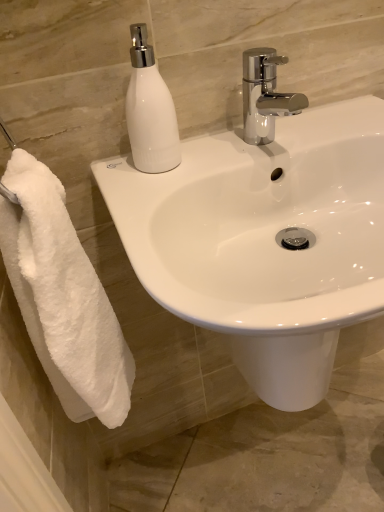
Question: Visually, is white glossy sink at center positioned to the left or to the right of chrome metallic faucet at upper center?

Choices:
 (A) left
 (B) right

Answer: (B)

Question: Considering the positions of white glossy sink at center and chrome metallic faucet at upper center in the image, is white glossy sink at center taller or shorter than chrome metallic faucet at upper center?

Choices:
 (A) short
 (B) tall

Answer: (B)

Question: Estimate the real-world distances between objects in this image. Which object is farther from the white glossy sink at center?

Choices:
 (A) white fluffy towel at left
 (B) chrome metallic faucet at upper center
 (C) white glossy soap dispenser at upper left

Answer: (A)

Question: Which of these objects is positioned closest to the white fluffy towel at left?

Choices:
 (A) chrome metallic faucet at upper center
 (B) white glossy sink at center
 (C) white glossy soap dispenser at upper left

Answer: (B)